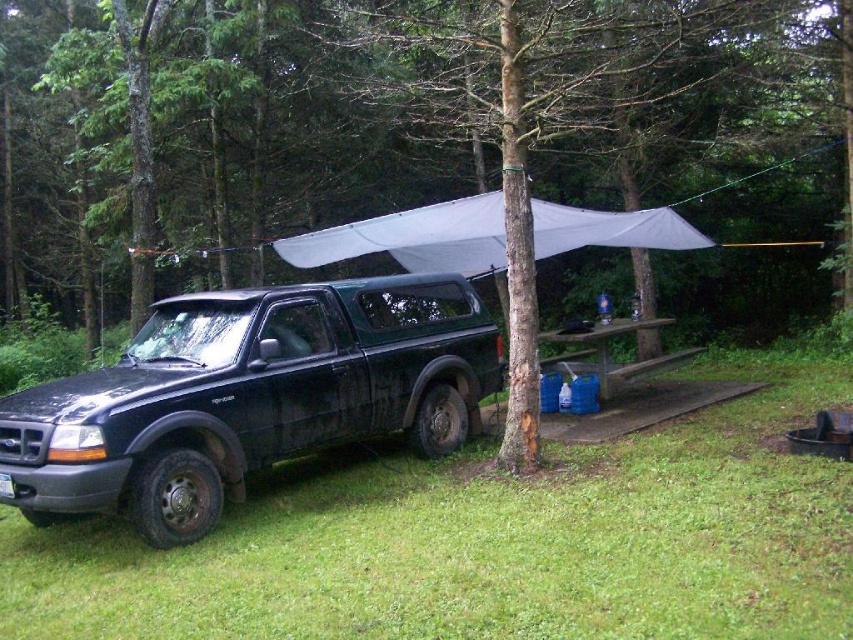
Is the position of green grass at lower left more distant than that of matte black truck at left?

That is False.

The width and height of the screenshot is (853, 640). Describe the element at coordinates (491, 540) in the screenshot. I see `green grass at lower left` at that location.

Between point (779, 636) and point (212, 410), which one is positioned in front?

Point (779, 636)

The width and height of the screenshot is (853, 640). I want to click on green grass at lower left, so click(491, 540).

Based on the photo, does green bark tree at center appear under blue plastic picnic table at center?

Incorrect, green bark tree at center is not positioned below blue plastic picnic table at center.

Based on the photo, is green bark tree at center wider than blue plastic picnic table at center?

Yes, green bark tree at center is wider than blue plastic picnic table at center.

Is point (747, 108) positioned before point (570, 362)?

No.

Where is `green bark tree at center`? Image resolution: width=853 pixels, height=640 pixels. green bark tree at center is located at coordinates (210, 141).

Which is more to the right, green bark tree at center or green grass at lower left?

From the viewer's perspective, green grass at lower left appears more on the right side.

Can you confirm if green bark tree at center is shorter than green grass at lower left?

No, green bark tree at center is not shorter than green grass at lower left.

Between point (723, 26) and point (64, 612), which one is positioned in front?

Positioned in front is point (64, 612).

Where is `green bark tree at center`? The image size is (853, 640). green bark tree at center is located at coordinates (210, 141).